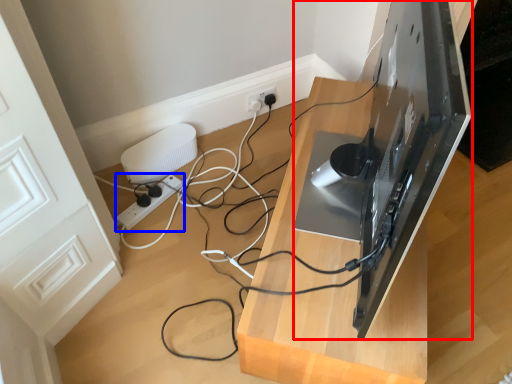
Question: Among these objects, which one is nearest to the camera, desktop computer (highlighted by a red box) or extension cord (highlighted by a blue box)?

Choices:
 (A) desktop computer
 (B) extension cord

Answer: (A)